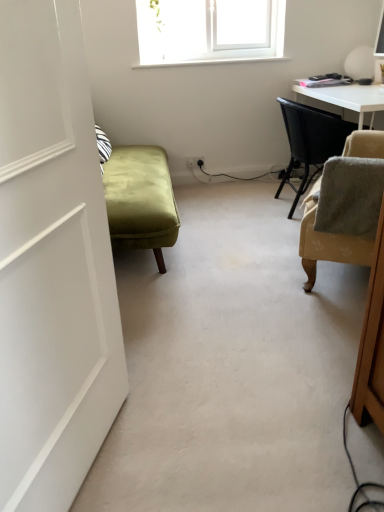
Question: Is beige fabric chair at right, which is the first chair from front to back, beside beige fabric chair at right, the 2th chair when ordered from front to back?

Choices:
 (A) yes
 (B) no

Answer: (B)

Question: From the image's perspective, is beige fabric chair at right, which is the first chair from front to back, on top of beige fabric chair at right, the first chair when ordered from back to front?

Choices:
 (A) no
 (B) yes

Answer: (A)

Question: From the image's perspective, is beige fabric chair at right, which is the first chair from front to back, beneath beige fabric chair at right, the 2th chair when ordered from front to back?

Choices:
 (A) yes
 (B) no

Answer: (A)

Question: Is beige fabric chair at right, which is the first chair from front to back, bigger than beige fabric chair at right, the first chair when ordered from back to front?

Choices:
 (A) no
 (B) yes

Answer: (A)

Question: From a real-world perspective, is beige fabric chair at right, which is counted as the 2th chair, starting from the back, located beneath beige fabric chair at right, the 2th chair when ordered from front to back?

Choices:
 (A) yes
 (B) no

Answer: (B)

Question: Can you confirm if beige fabric chair at right, which is the first chair from front to back, is shorter than beige fabric chair at right, the first chair when ordered from back to front?

Choices:
 (A) no
 (B) yes

Answer: (B)

Question: Is beige fabric chair at right, the first chair when ordered from back to front, behind white matte door at left?

Choices:
 (A) no
 (B) yes

Answer: (B)

Question: Is beige fabric chair at right, the first chair when ordered from back to front, positioned in front of white matte door at left?

Choices:
 (A) no
 (B) yes

Answer: (A)

Question: Would you consider beige fabric chair at right, the first chair when ordered from back to front, to be distant from white matte door at left?

Choices:
 (A) yes
 (B) no

Answer: (A)

Question: From a real-world perspective, is beige fabric chair at right, the 2th chair when ordered from front to back, positioned over white matte door at left based on gravity?

Choices:
 (A) yes
 (B) no

Answer: (B)

Question: Is beige fabric chair at right, the first chair when ordered from back to front, positioned with its back to white matte door at left?

Choices:
 (A) yes
 (B) no

Answer: (B)

Question: Is white matte door at left completely or partially inside beige fabric chair at right, the first chair when ordered from back to front?

Choices:
 (A) no
 (B) yes

Answer: (A)

Question: Is beige fabric chair at right, which is counted as the 2th chair, starting from the back, positioned before white matte door at left?

Choices:
 (A) no
 (B) yes

Answer: (A)